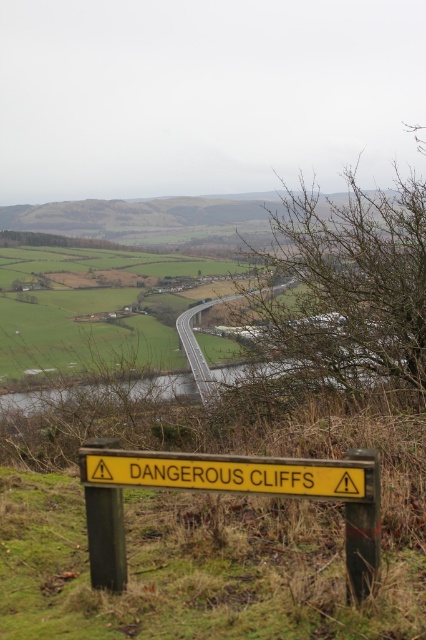
Between yellow wooden sign at lower center and yellowmaterial/texturewarning sign at lower center, which one has less height?

yellowmaterial/texturewarning sign at lower center is shorter.

Between yellow wooden sign at lower center and yellowmaterial/texturewarning sign at lower center, which one appears on the right side from the viewer's perspective?

yellowmaterial/texturewarning sign at lower center is more to the right.

Who is more distant from viewer, (348, 596) or (195, 458)?

Point (195, 458)

You are a GUI agent. You are given a task and a screenshot of the screen. Output one action in this format:
    pyautogui.click(x=<x>, y=<y>)
    Task: Click on the yellow wooden sign at lower center
    The height and width of the screenshot is (640, 426).
    Given the screenshot: What is the action you would take?
    pyautogui.click(x=227, y=490)

Between point (143, 452) and point (144, 216), which one is positioned behind?

The point (144, 216) is more distant.

Is yellow wooden sign at lower center smaller than brown grassy hillside at upper center?

Indeed, yellow wooden sign at lower center has a smaller size compared to brown grassy hillside at upper center.

Is point (91, 509) positioned in front of point (0, 225)?

Yes.

Where is `yellow wooden sign at lower center`? The image size is (426, 640). yellow wooden sign at lower center is located at coordinates tap(227, 490).

How far apart are brown grassy hillside at upper center and yellowmaterial/texturewarning sign at lower center?

34.68 feet

Does brown grassy hillside at upper center appear under yellowmaterial/texturewarning sign at lower center?

Incorrect, brown grassy hillside at upper center is not positioned below yellowmaterial/texturewarning sign at lower center.

Image resolution: width=426 pixels, height=640 pixels. What do you see at coordinates (149, 218) in the screenshot?
I see `brown grassy hillside at upper center` at bounding box center [149, 218].

Find the location of a particular element. Image resolution: width=426 pixels, height=640 pixels. brown grassy hillside at upper center is located at coordinates (149, 218).